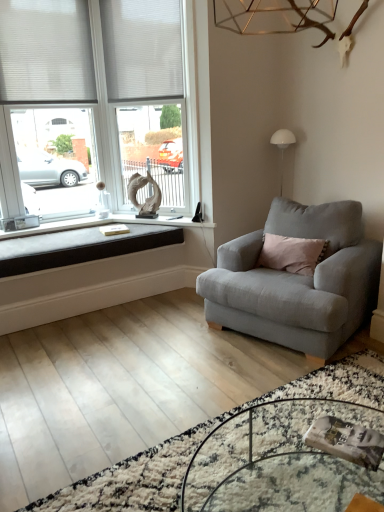
Question: Considering the relative positions of white fabric blind at upper left, marked as the second blind in a right-to-left arrangement, and light gray fabric armchair at right in the image provided, is white fabric blind at upper left, marked as the second blind in a right-to-left arrangement, to the left of light gray fabric armchair at right from the viewer's perspective?

Choices:
 (A) no
 (B) yes

Answer: (B)

Question: Does white fabric blind at upper left, marked as the second blind in a right-to-left arrangement, have a smaller size compared to light gray fabric armchair at right?

Choices:
 (A) yes
 (B) no

Answer: (A)

Question: Does white fabric blind at upper left, marked as the second blind in a right-to-left arrangement, come in front of light gray fabric armchair at right?

Choices:
 (A) yes
 (B) no

Answer: (B)

Question: Considering the relative sizes of white fabric blind at upper left, placed as the 1th blind when sorted from left to right, and light gray fabric armchair at right in the image provided, is white fabric blind at upper left, placed as the 1th blind when sorted from left to right, shorter than light gray fabric armchair at right?

Choices:
 (A) no
 (B) yes

Answer: (A)

Question: Is white fabric blind at upper left, marked as the second blind in a right-to-left arrangement, bigger than light gray fabric armchair at right?

Choices:
 (A) yes
 (B) no

Answer: (B)

Question: Is white fabric blind at upper left, placed as the 1th blind when sorted from left to right, facing away from light gray fabric armchair at right?

Choices:
 (A) yes
 (B) no

Answer: (B)

Question: From the image's perspective, is white matte window at upper left on black fabric cushion at lower left?

Choices:
 (A) yes
 (B) no

Answer: (A)

Question: Is white matte window at upper left looking in the opposite direction of black fabric cushion at lower left?

Choices:
 (A) yes
 (B) no

Answer: (B)

Question: Is the position of white matte window at upper left less distant than that of black fabric cushion at lower left?

Choices:
 (A) no
 (B) yes

Answer: (A)

Question: Can black fabric cushion at lower left be found inside white matte window at upper left?

Choices:
 (A) no
 (B) yes

Answer: (A)

Question: From the image's perspective, does white matte window at upper left appear lower than black fabric cushion at lower left?

Choices:
 (A) yes
 (B) no

Answer: (B)

Question: Can you confirm if white matte window at upper left is smaller than black fabric cushion at lower left?

Choices:
 (A) no
 (B) yes

Answer: (A)

Question: Considering the relative sizes of white fabric blind at upper left, the first blind when ordered from right to left, and white plastic window frame at upper left in the image provided, is white fabric blind at upper left, the first blind when ordered from right to left, wider than white plastic window frame at upper left?

Choices:
 (A) no
 (B) yes

Answer: (A)